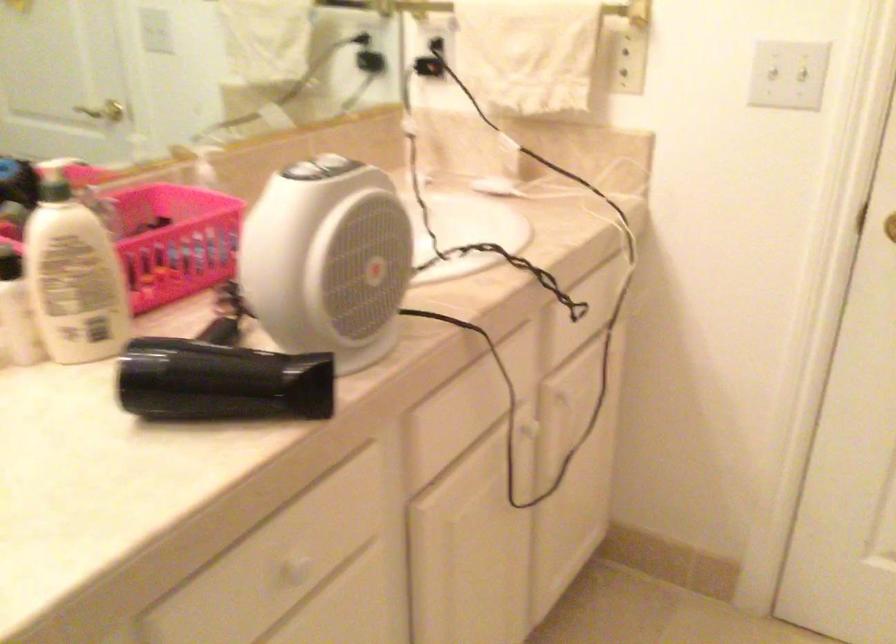
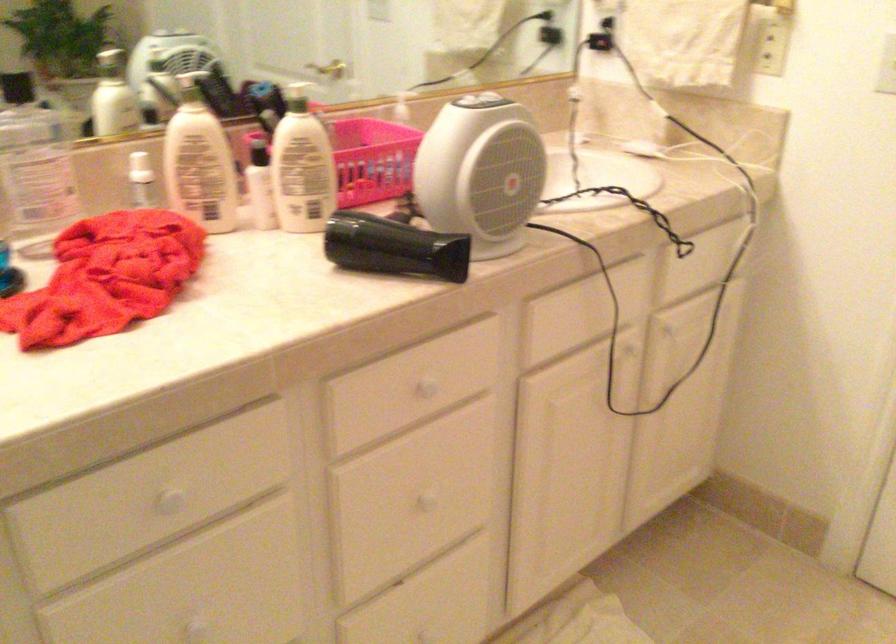
Find the pixel in the second image that matches point (179, 240) in the first image.

(367, 158)